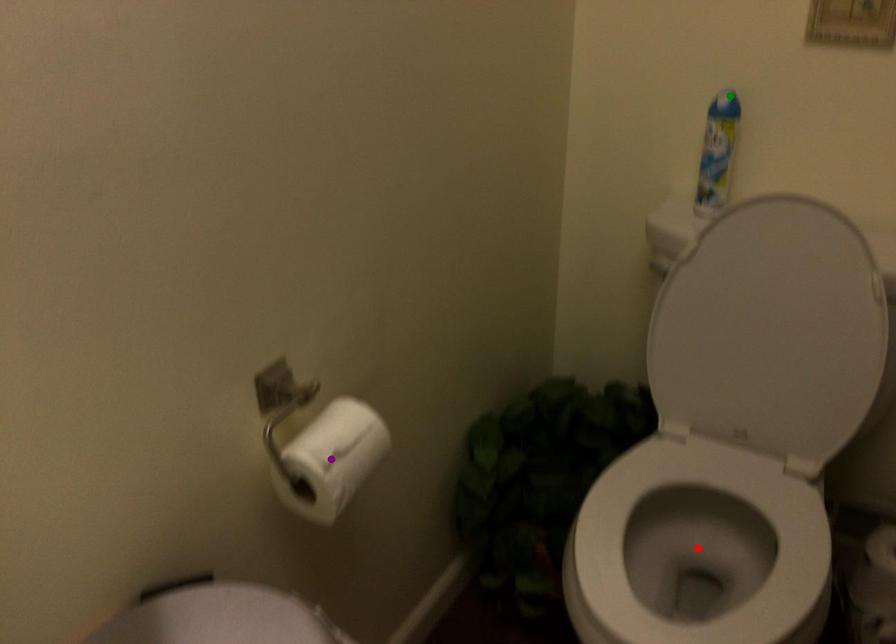
Consider the image. Order these from nearest to farthest:
A) purple point
B) red point
C) green point

1. purple point
2. red point
3. green point